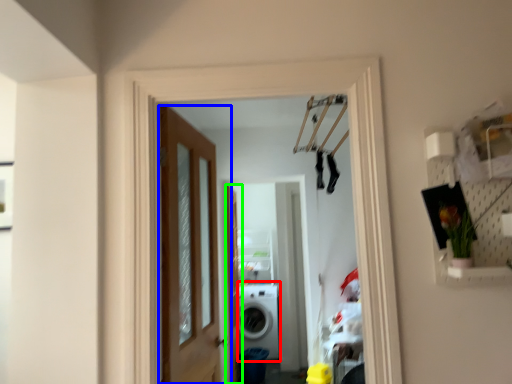
Question: Considering the real-world distances, which object is closest to washing machine (highlighted by a red box)? door (highlighted by a blue box) or screen door (highlighted by a green box).

Choices:
 (A) door
 (B) screen door

Answer: (B)